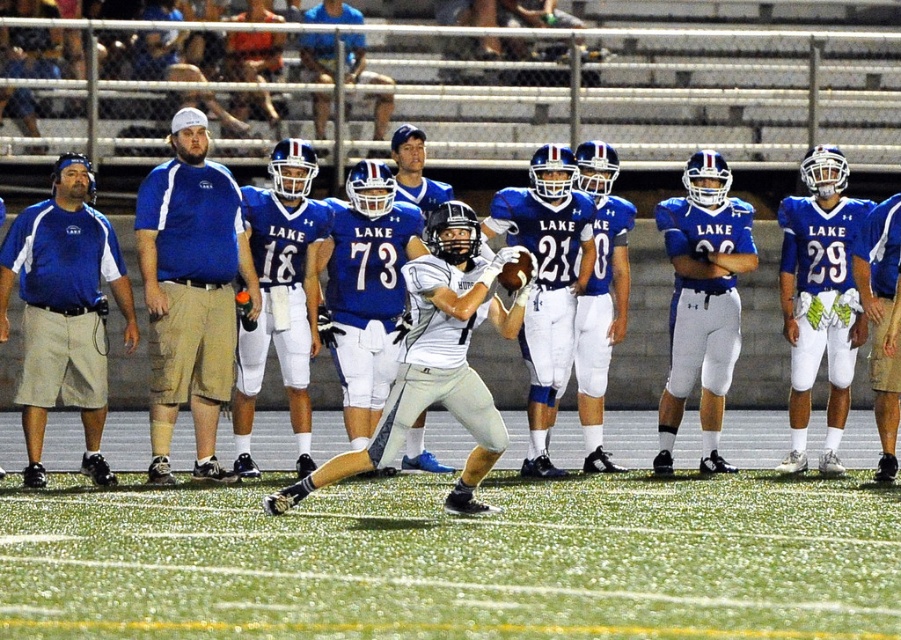
Question: Does white matte jersey at center lie behind matte blue helmet at upper center?

Choices:
 (A) yes
 (B) no

Answer: (B)

Question: Which point is closer to the camera?

Choices:
 (A) green turf at center
 (B) blue fabric shirt at left
 (C) matte blue helmet at upper center

Answer: (A)

Question: Does blue matte uniform at center have a greater width compared to blue fabric shirt at left?

Choices:
 (A) yes
 (B) no

Answer: (A)

Question: Which point is farther from the camera taking this photo?

Choices:
 (A) (176, 445)
 (B) (348, 64)
 (C) (64, 348)
 (D) (489, 394)

Answer: (B)

Question: Does blue matte uniform at center appear under matte blue helmet at upper center?

Choices:
 (A) no
 (B) yes

Answer: (B)

Question: Which object appears closest to the camera in this image?

Choices:
 (A) green turf at center
 (B) white matte jersey at center
 (C) matte blue shirt at left
 (D) blue matte uniform at center

Answer: (A)